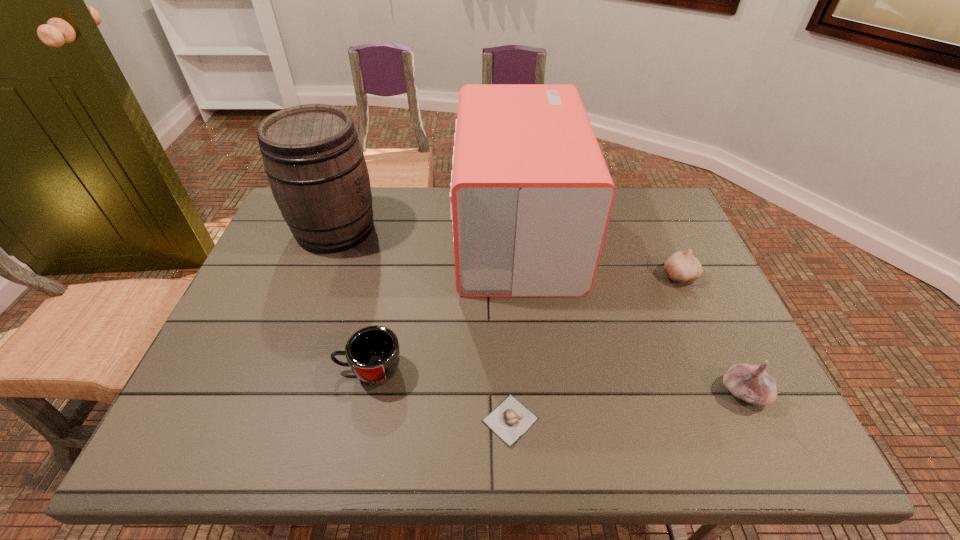
Where is `vacant region between the tallest garlic and the leftmost garlic`? The height and width of the screenshot is (540, 960). vacant region between the tallest garlic and the leftmost garlic is located at coordinates [627, 406].

At what (x,y) coordinates should I click in order to perform the action: click on vacant space that's between the mug and the second tallest garlic. Please return your answer as a coordinate pair (x, y). Looking at the image, I should click on (524, 322).

Where is `empty space between the mug and the tallest garlic`? The height and width of the screenshot is (540, 960). empty space between the mug and the tallest garlic is located at coordinates (557, 381).

I want to click on blank region between the wine bucket and the tallest garlic, so click(x=540, y=310).

I want to click on the fourth closest object to the second shortest garlic, so point(373,353).

Select which object is the closest to the farthest garlic. Please provide its 2D coordinates. Your answer should be formatted as a tuple, i.e. [(x, y)], where the tuple contains the x and y coordinates of a point satisfying the conditions above.

[(531, 196)]

Select which garlic appears as the second closest to the second shortest garlic. Please provide its 2D coordinates. Your answer should be formatted as a tuple, i.e. [(x, y)], where the tuple contains the x and y coordinates of a point satisfying the conditions above.

[(510, 420)]

The width and height of the screenshot is (960, 540). Identify the location of the second closest garlic to the mug. (751, 383).

Where is `vacant region that satisfies the following two spatial constraints: 1. on the back side of the shortest object; 2. on the side of the mug with the handle`? This screenshot has width=960, height=540. vacant region that satisfies the following two spatial constraints: 1. on the back side of the shortest object; 2. on the side of the mug with the handle is located at coordinates pyautogui.click(x=508, y=370).

Where is `blank area in the image that satisfies the following two spatial constraints: 1. on the back side of the shortest object; 2. on the side of the mug with the handle`? The image size is (960, 540). blank area in the image that satisfies the following two spatial constraints: 1. on the back side of the shortest object; 2. on the side of the mug with the handle is located at coordinates (508, 370).